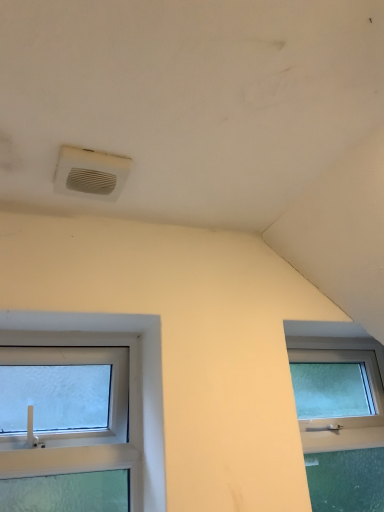
You are a GUI agent. You are given a task and a screenshot of the screen. Output one action in this format:
    pyautogui.click(x=<x>, y=<y>)
    Task: Click on the clear glass window at lower left
    
    Given the screenshot: What is the action you would take?
    pyautogui.click(x=129, y=399)

Describe the element at coordinates (129, 399) in the screenshot. I see `clear glass window at lower left` at that location.

Find the location of `white plastic air conditioning at upper center`. white plastic air conditioning at upper center is located at coordinates (90, 173).

What do you see at coordinates (90, 173) in the screenshot?
I see `white plastic air conditioning at upper center` at bounding box center [90, 173].

Identify the location of clear glass window at lower left. This screenshot has height=512, width=384. (129, 399).

Considering the relative positions of white plastic air conditioning at upper center and clear glass window at lower left in the image provided, is white plastic air conditioning at upper center to the left of clear glass window at lower left from the viewer's perspective?

Incorrect, white plastic air conditioning at upper center is not on the left side of clear glass window at lower left.

In the scene shown: Is white plastic air conditioning at upper center in front of clear glass window at lower left?

Yes, white plastic air conditioning at upper center is in front of clear glass window at lower left.

Is point (59, 159) closer or farther from the camera than point (29, 327)?

Point (59, 159) appears to be closer to the viewer than point (29, 327).

From the image's perspective, which one is positioned higher, white plastic air conditioning at upper center or clear glass window at lower left?

white plastic air conditioning at upper center, from the image's perspective.

From a real-world perspective, which object stands above the other?

In real-world perspective, white plastic air conditioning at upper center is above.

Which object is thinner, white plastic air conditioning at upper center or clear glass window at lower left?

Thinner between the two is clear glass window at lower left.

In terms of height, does white plastic air conditioning at upper center look taller or shorter compared to clear glass window at lower left?

In the image, white plastic air conditioning at upper center appears to be shorter than clear glass window at lower left.

Who is smaller, white plastic air conditioning at upper center or clear glass window at lower left?

white plastic air conditioning at upper center is smaller.

Is white plastic air conditioning at upper center located outside clear glass window at lower left?

white plastic air conditioning at upper center is positioned outside clear glass window at lower left.

Is white plastic air conditioning at upper center placed right next to clear glass window at lower left?

No, white plastic air conditioning at upper center is not making contact with clear glass window at lower left.

Could you tell me if white plastic air conditioning at upper center is facing clear glass window at lower left?

No, white plastic air conditioning at upper center is not aimed at clear glass window at lower left.

How distant is white plastic air conditioning at upper center from clear glass window at lower left?

51.76 centimeters.

This screenshot has height=512, width=384. I want to click on air conditioning above the clear glass window at lower left (from the image's perspective), so [90, 173].

Which is more to the right, clear glass window at lower left or white plastic air conditioning at upper center?

Positioned to the right is white plastic air conditioning at upper center.

Considering the positions of objects clear glass window at lower left and white plastic air conditioning at upper center in the image provided, who is behind, clear glass window at lower left or white plastic air conditioning at upper center?

Positioned behind is clear glass window at lower left.

Which is closer, (x=55, y=451) or (x=120, y=170)?

Point (x=55, y=451).

From the image's perspective, is clear glass window at lower left located above or below white plastic air conditioning at upper center?

clear glass window at lower left is situated lower than white plastic air conditioning at upper center in the image.

From the picture: From a real-world perspective, is clear glass window at lower left located higher than white plastic air conditioning at upper center?

No, from a real-world perspective, clear glass window at lower left is not on top of white plastic air conditioning at upper center.

Which object is thinner, clear glass window at lower left or white plastic air conditioning at upper center?

clear glass window at lower left.

Considering the sizes of objects clear glass window at lower left and white plastic air conditioning at upper center in the image provided, who is shorter, clear glass window at lower left or white plastic air conditioning at upper center?

With less height is white plastic air conditioning at upper center.

Which of these two, clear glass window at lower left or white plastic air conditioning at upper center, is smaller?

Smaller between the two is white plastic air conditioning at upper center.

Is clear glass window at lower left located outside white plastic air conditioning at upper center?

Yes, clear glass window at lower left is located beyond the bounds of white plastic air conditioning at upper center.

Based on the photo, is clear glass window at lower left positioned far away from white plastic air conditioning at upper center?

Actually, clear glass window at lower left and white plastic air conditioning at upper center are a little close together.

Is clear glass window at lower left facing away from white plastic air conditioning at upper center?

clear glass window at lower left does not have its back to white plastic air conditioning at upper center.

How different are the orientations of clear glass window at lower left and white plastic air conditioning at upper center in degrees?

The angle between the facing direction of clear glass window at lower left and the facing direction of white plastic air conditioning at upper center is 2.53 degrees.

This screenshot has width=384, height=512. Find the location of `window to the left of white plastic air conditioning at upper center`. window to the left of white plastic air conditioning at upper center is located at coordinates (129, 399).

You are a GUI agent. You are given a task and a screenshot of the screen. Output one action in this format:
    pyautogui.click(x=<x>, y=<y>)
    Task: Click on the window behind the white plastic air conditioning at upper center
    This screenshot has height=512, width=384.
    Given the screenshot: What is the action you would take?
    pyautogui.click(x=129, y=399)

Where is `window on the left of the white plastic air conditioning at upper center`? window on the left of the white plastic air conditioning at upper center is located at coordinates (129, 399).